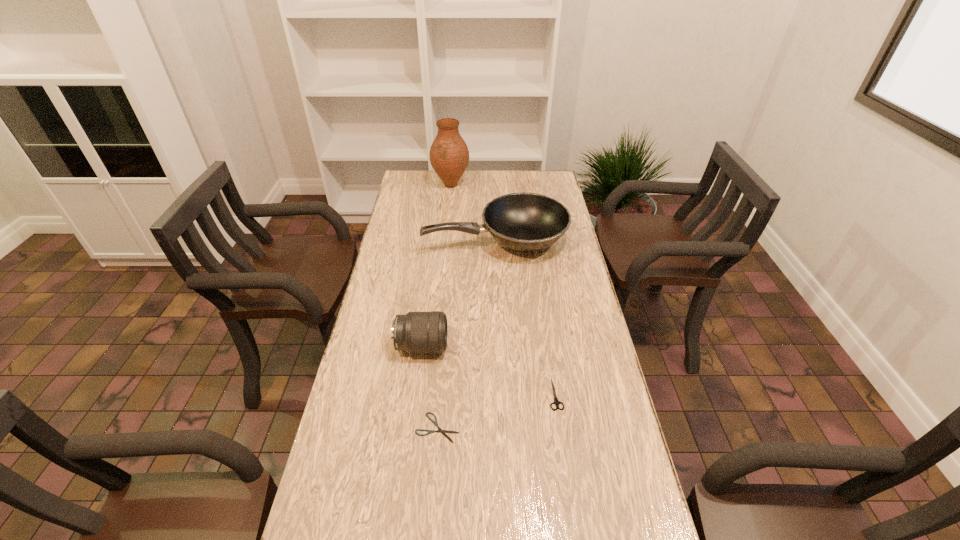
Identify the location of free space that satisfies the following two spatial constraints: 1. on the front side of the farthest object; 2. on the right side of the fourth tallest object. (430, 394).

Find the location of a particular element. free location that satisfies the following two spatial constraints: 1. on the surface of the telephoto lens; 2. on the back side of the nearest object is located at coordinates coord(411,428).

Identify the location of vacant position in the image that satisfies the following two spatial constraints: 1. on the surface of the third nearest object; 2. on the left side of the taller shears. (416, 394).

Identify the location of free space that satisfies the following two spatial constraints: 1. on the surface of the nearer shears; 2. on the right side of the telephoto lens. The width and height of the screenshot is (960, 540). (411, 428).